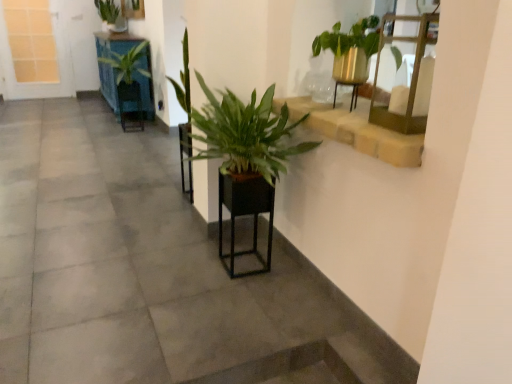
Locate an element on the screen. This screenshot has height=384, width=512. free point below black matte planter at center, placed as the first armchair when sorted from bottom to top (from a real-world perspective) is located at coordinates (247, 266).